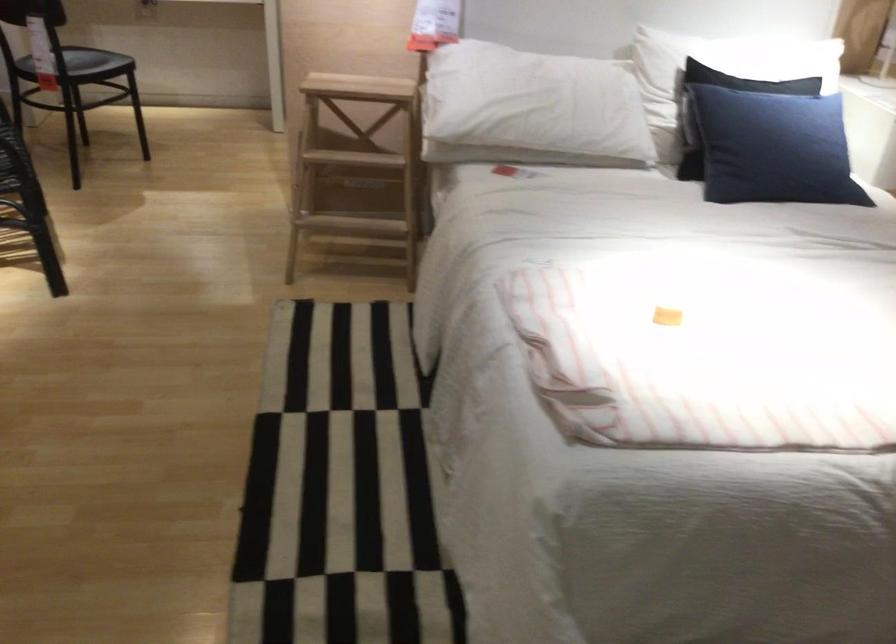
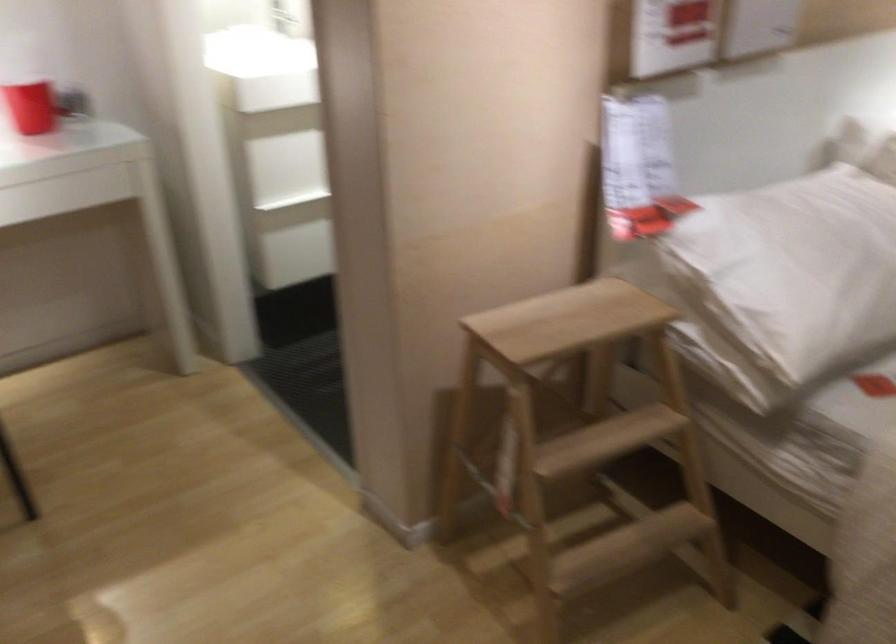
Consider the image. In a continuous first-person perspective shot, in which direction is the camera moving?

The cameraman walked toward left, forward.